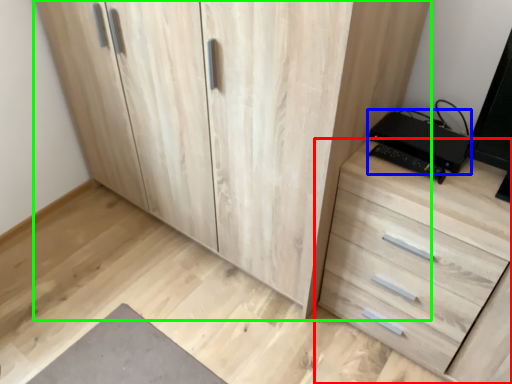
Question: Which object is positioned closest to chest of drawers (highlighted by a red box)? Select from computer (highlighted by a blue box) and cupboard (highlighted by a green box).

Choices:
 (A) computer
 (B) cupboard

Answer: (A)